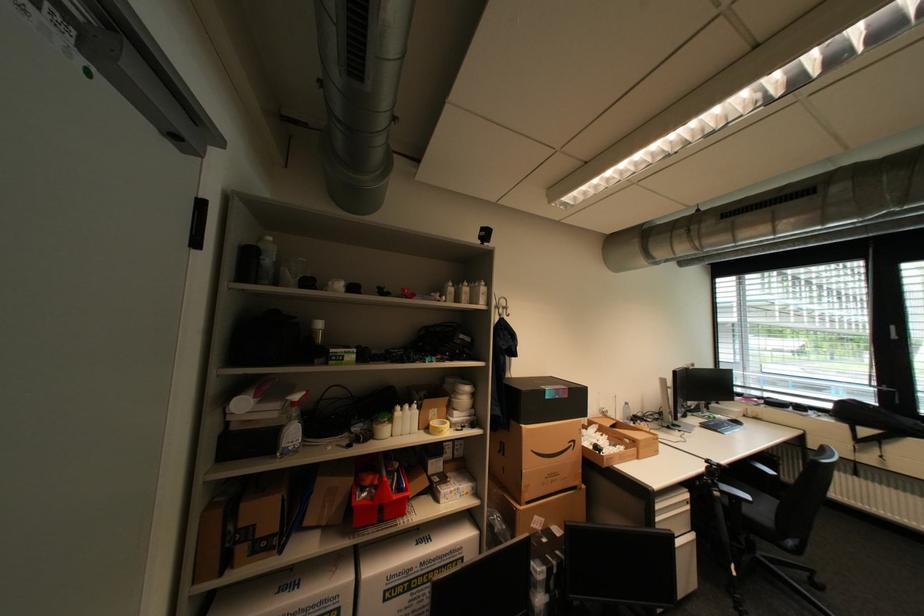
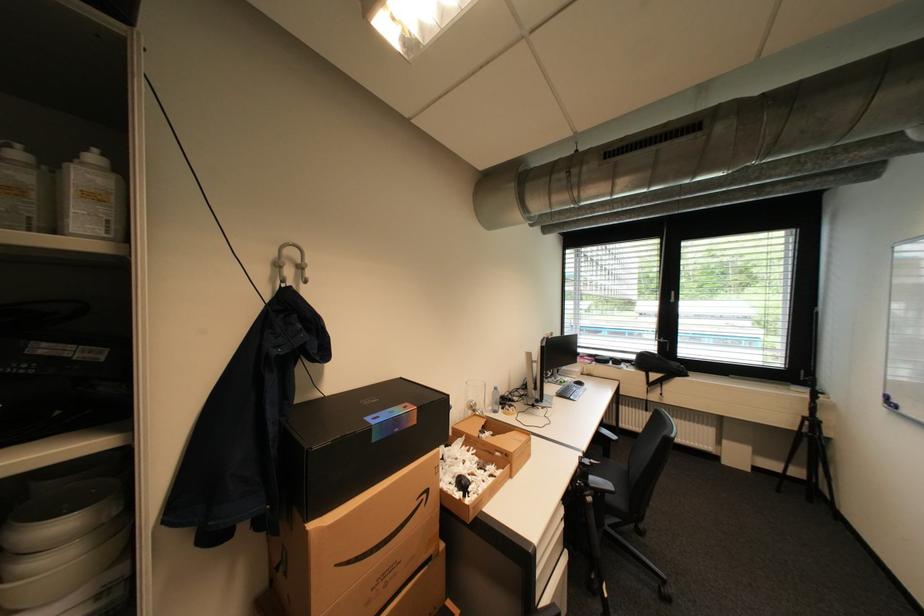
In the second image, find the point that corresponds to point (508, 310) in the first image.

(297, 272)